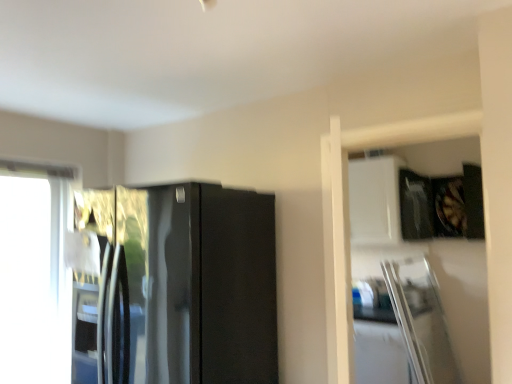
Question: From the image's perspective, is transparent glass window at left above or below glossy black refrigerator at center?

Choices:
 (A) below
 (B) above

Answer: (A)

Question: Would you say transparent glass window at left is inside or outside glossy black refrigerator at center?

Choices:
 (A) inside
 (B) outside

Answer: (B)

Question: From a real-world perspective, is transparent glass window at left above or below glossy black refrigerator at center?

Choices:
 (A) below
 (B) above

Answer: (B)

Question: Choose the correct answer: Is glossy black refrigerator at center inside transparent glass window at left or outside it?

Choices:
 (A) inside
 (B) outside

Answer: (B)

Question: In terms of width, does glossy black refrigerator at center look wider or thinner when compared to transparent glass window at left?

Choices:
 (A) wide
 (B) thin

Answer: (A)

Question: In the image, is glossy black refrigerator at center positioned in front of or behind transparent glass window at left?

Choices:
 (A) behind
 (B) front

Answer: (B)

Question: Considering the positions of point (106, 200) and point (70, 369), is point (106, 200) closer or farther from the camera than point (70, 369)?

Choices:
 (A) farther
 (B) closer

Answer: (B)